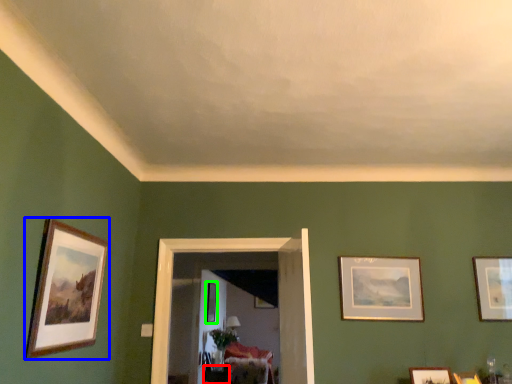
Question: Which object is the farthest from table (highlighted by a red box)? Choose among these: picture frame (highlighted by a blue box) or picture frame (highlighted by a green box).

Choices:
 (A) picture frame
 (B) picture frame

Answer: (A)